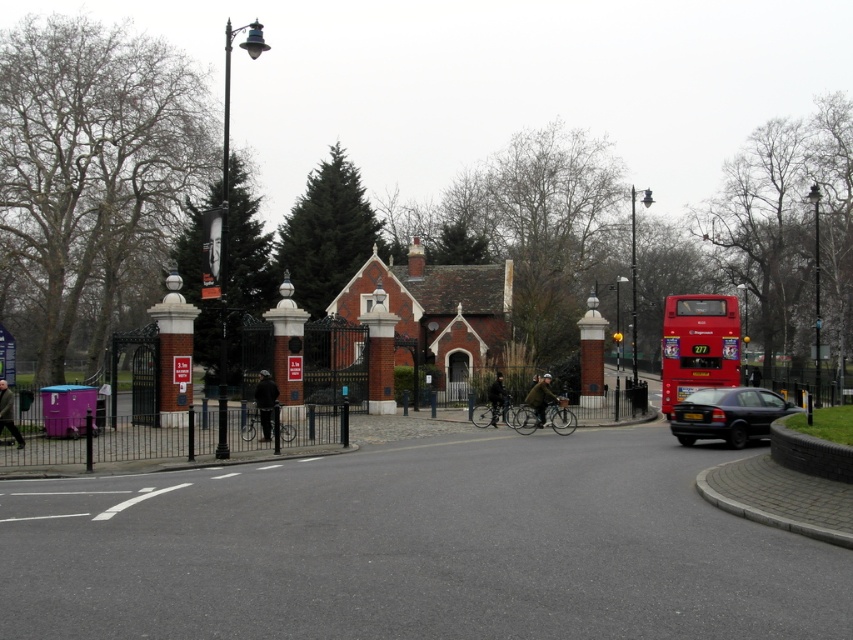
You are a pedestrian standing at the entrance of the red brick building and want to cross the street to reach a bench on the opposite side. There is a red metallic bus at right and a black matte sedan at lower right. Which vehicle should you avoid to safely cross the street?

You should avoid the red metallic bus at right because it is to the right of the black matte sedan at lower right, meaning it is closer to the street where you need to cross.

You are a pedestrian standing in front of the red brick building and want to cross the street to reach the black wrought iron gate. There is a red metallic bus at right and a black matte sedan at lower right. Which vehicle is closer to you, the pedestrian, so you need to be cautious of first?

The red metallic bus at right is closer to you than the black matte sedan at lower right, so you should be cautious of the red metallic bus at right first.

You are a delivery person who needs to park your van between the red metallic bus at right and the black matte sedan at lower right. The van is 20 feet long. Can you safely park your van in this space without overlapping either vehicle?

The distance between the red metallic bus at right and the black matte sedan at lower right is 28.61 feet. Since the van is 20 feet long, there is enough space to park between them without overlapping either vehicle.